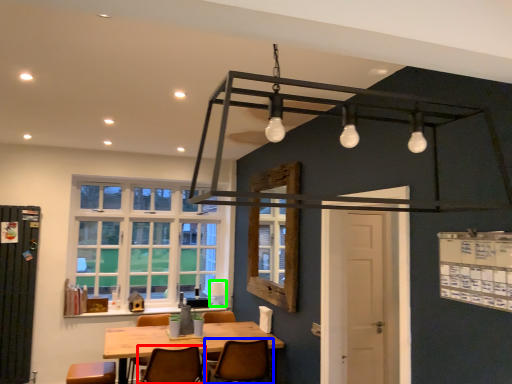
Question: Which object is positioned closest to chair (highlighted by a red box)? Select from chair (highlighted by a blue box) and lamp (highlighted by a green box).

Choices:
 (A) chair
 (B) lamp

Answer: (A)